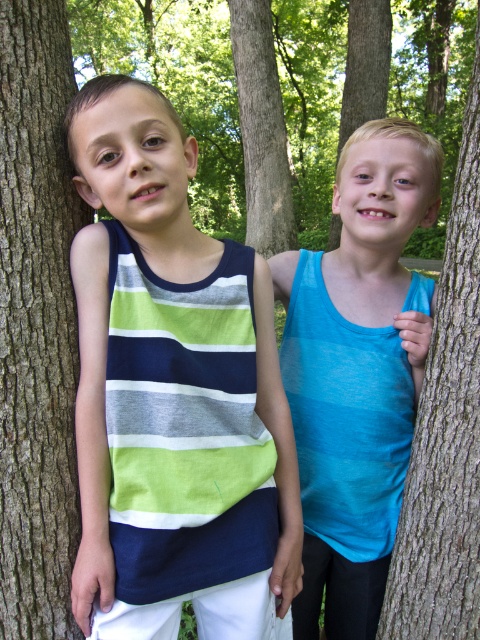
You are a photographer standing 1.5 meters away from the camera. You want to take a closeup shot of the striped cotton tank top at left. Can you reach it with your camera?

The striped cotton tank top at left is 1.16 meters from camera, so yes, you can reach it with your camera since you are only 1.5 meters away from the camera.

You are a photographer trying to capture the two boys in the scene. You want to ensure that the blue smooth tank top at right is visible above the brown rough tree trunk at left in your photo. Based on their current positions, is this possible?

The blue smooth tank top at right is located below the brown rough tree trunk at left, so it would not be possible to have the blue smooth tank top at right visible above the brown rough tree trunk at left in the photo.

You are a photographer trying to capture both the blue smooth tank top at right and the brown rough tree trunk at left in a single frame. Based on their sizes, which object should you focus on first to ensure they both fit in the shot?

The blue smooth tank top at right is bigger than the brown rough tree trunk at left, so you should focus on framing the blue smooth tank top at right first to ensure both objects fit in the shot.